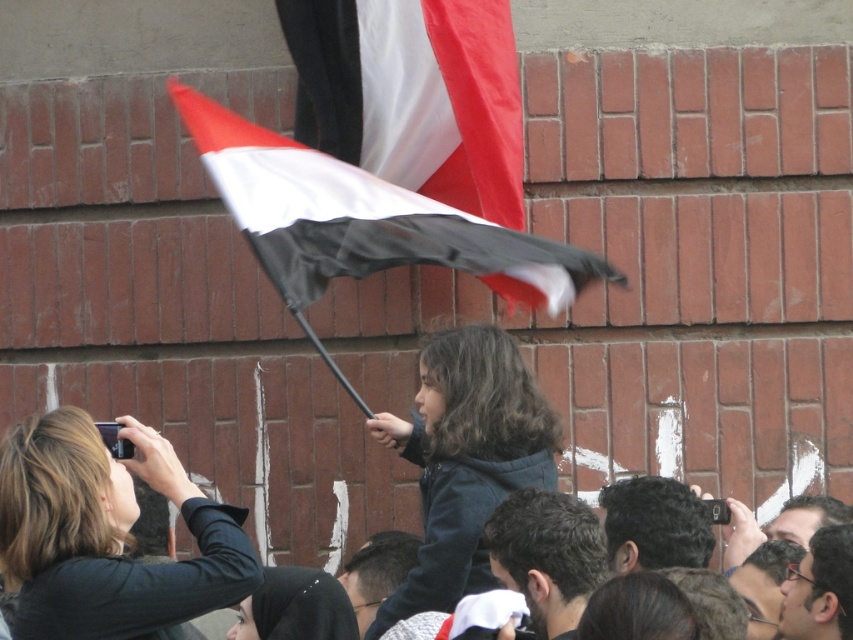
You are standing in the crowd and want to take a photo of the black matte flag at center. If you are at position coordinates of point 0, where should you position yourself to capture the flag in the center of your photo?

Since the black matte flag at center is located at point coordinates [363,220], you should position yourself at coordinates [363,220] to center the flag in your photo.

You are a photographer trying to capture a clear shot of the dark brown hair at center and dark brown hair at lower center. Which one will appear larger in your photo?

The dark brown hair at center will appear larger in the photo since it is closer to the viewer than the dark brown hair at lower center.